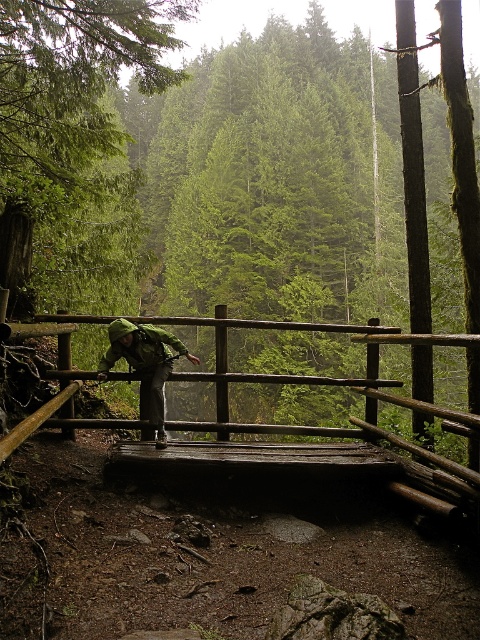
Question: Which point is closer to the camera?

Choices:
 (A) (113, 330)
 (B) (149, 340)
 (C) (421, 448)

Answer: (A)

Question: Estimate the real-world distances between objects in this image. Which object is farther from the green camouflage jacket at center?

Choices:
 (A) wooden bridge at center
 (B) green matte jacket at center

Answer: (A)

Question: Does wooden bridge at center have a greater width compared to green camouflage jacket at center?

Choices:
 (A) no
 (B) yes

Answer: (A)

Question: Which of the following is the closest to the observer?

Choices:
 (A) (132, 323)
 (B) (443, 339)
 (C) (151, 356)

Answer: (B)

Question: From the image, what is the correct spatial relationship of green camouflage jacket at center in relation to green matte jacket at center?

Choices:
 (A) left
 (B) right

Answer: (A)

Question: Can you confirm if wooden bridge at center is thinner than green matte jacket at center?

Choices:
 (A) no
 (B) yes

Answer: (B)